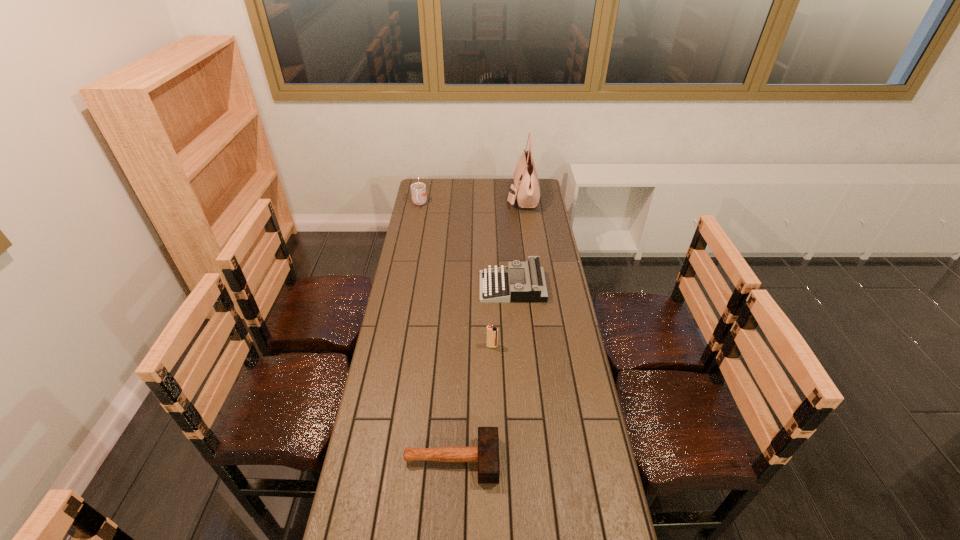
Where is `the tallest object`? The height and width of the screenshot is (540, 960). the tallest object is located at coordinates (526, 189).

Identify the location of cup. (418, 190).

The height and width of the screenshot is (540, 960). Identify the location of the leftmost object. (418, 190).

Where is `the fourth farthest object`? the fourth farthest object is located at coordinates (492, 332).

Identify the location of the second shortest object. This screenshot has height=540, width=960. (532, 287).

Locate an element on the screen. This screenshot has height=540, width=960. the third nearest object is located at coordinates (532, 287).

Locate an element on the screen. the nearest object is located at coordinates (486, 454).

Identify the location of mallet. (486, 454).

The height and width of the screenshot is (540, 960). I want to click on free spot located on the side of the handbag with the attached pouch, so click(x=492, y=197).

In order to click on free location located on the side of the handbag with the attached pouch in this screenshot , I will do `click(491, 197)`.